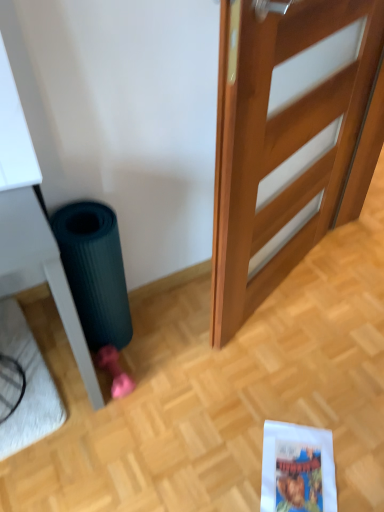
The width and height of the screenshot is (384, 512). What are the coordinates of `free space between wooden door at center and blue glossy comic book at lower right` in the screenshot? It's located at (297, 360).